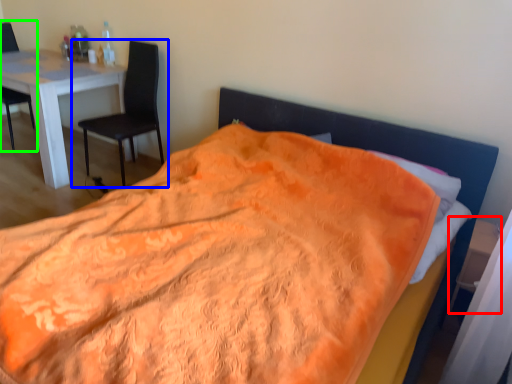
Question: Which is nearer to the side table (highlighted by a red box)? chair (highlighted by a blue box) or chair (highlighted by a green box).

Choices:
 (A) chair
 (B) chair

Answer: (A)